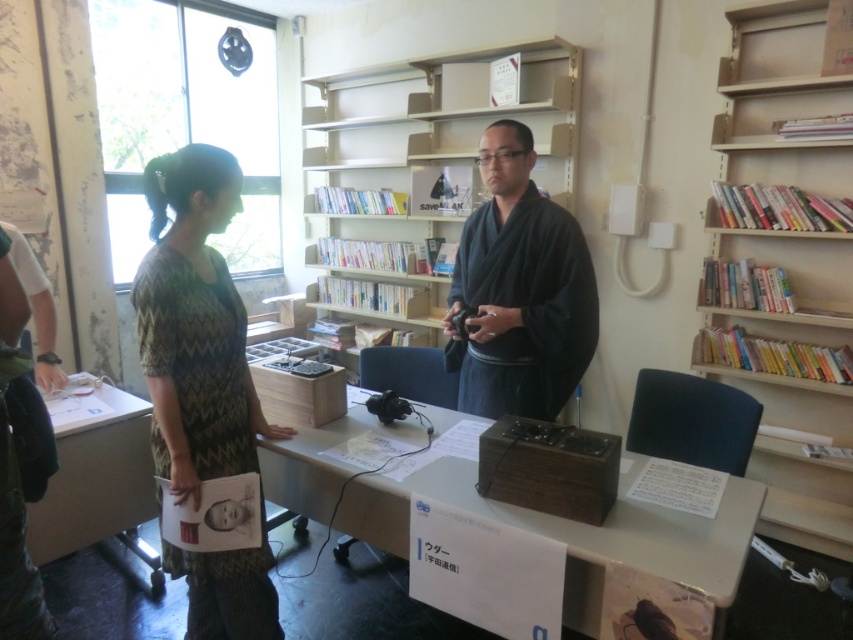
Question: Which of the following is the farthest from the observer?

Choices:
 (A) wooden table at center
 (B) wooden bookshelf at right

Answer: (B)

Question: Does dark blue kimono at center have a smaller size compared to white glossy table at lower left?

Choices:
 (A) no
 (B) yes

Answer: (A)

Question: Does dark blue kimono at center have a lesser width compared to white glossy table at lower left?

Choices:
 (A) no
 (B) yes

Answer: (A)

Question: Does light beige wooden bookcase at upper center appear on the left side of dark blue kimono at center?

Choices:
 (A) no
 (B) yes

Answer: (B)

Question: Which of the following is the closest to the observer?

Choices:
 (A) dark blue kimono at center
 (B) light beige wooden bookcase at upper center
 (C) patterned fabric dress at left
 (D) wooden table at center

Answer: (D)

Question: Based on their relative distances, which object is nearer to the dark blue kimono at center?

Choices:
 (A) light beige wooden bookcase at upper center
 (B) wooden table at center

Answer: (B)